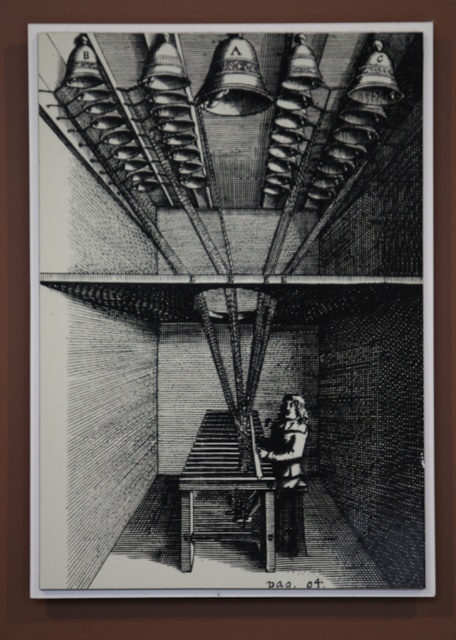
Question: Which point is farther from the camera taking this photo?

Choices:
 (A) (288, 516)
 (B) (289, 518)

Answer: (A)

Question: Does dark brown wood figure at center have a smaller size compared to wooden stool at center?

Choices:
 (A) no
 (B) yes

Answer: (A)

Question: Does dark brown wood figure at center lie in front of wooden stool at center?

Choices:
 (A) yes
 (B) no

Answer: (A)

Question: Does dark brown wood figure at center appear on the right side of wooden stool at center?

Choices:
 (A) yes
 (B) no

Answer: (B)